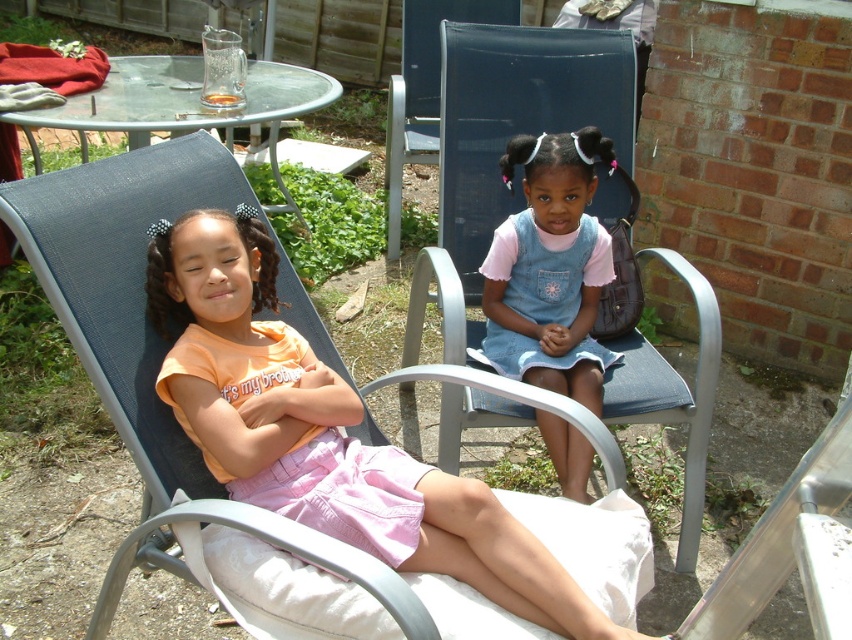
Does pink cotton shorts at lower left have a lesser width compared to denim dress at center?

No, pink cotton shorts at lower left is not thinner than denim dress at center.

Does point (325, 515) come behind point (527, 296)?

No, (325, 515) is closer to viewer.

Measure the distance between point (540, 600) and camera.

Point (540, 600) is 1.34 meters away from camera.

Where is `pink cotton shorts at lower left`? This screenshot has height=640, width=852. pink cotton shorts at lower left is located at coordinates (326, 433).

Is blue fabric chair at center bigger than blue fabric chair at upper center?

Correct, blue fabric chair at center is larger in size than blue fabric chair at upper center.

Can you confirm if blue fabric chair at center is shorter than blue fabric chair at upper center?

In fact, blue fabric chair at center may be taller than blue fabric chair at upper center.

Does point (502, 184) come closer to viewer compared to point (433, 6)?

Yes, point (502, 184) is closer to viewer.

This screenshot has height=640, width=852. In order to click on blue fabric chair at center in this screenshot , I will do `click(502, 148)`.

Which is behind, point (537, 572) or point (409, 113)?

Positioned behind is point (409, 113).

Measure the distance from pink cotton shorts at lower left to blue fabric chair at upper center.

6.91 feet

Does point (173, 292) lie behind point (435, 13)?

No, (173, 292) is closer to viewer.

This screenshot has height=640, width=852. In order to click on pink cotton shorts at lower left in this screenshot , I will do `click(326, 433)`.